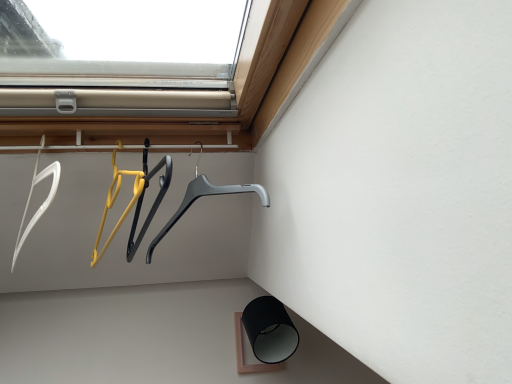
This screenshot has width=512, height=384. What do you see at coordinates (42, 203) in the screenshot?
I see `white plastic hanger at left, placed as the second hanger when sorted from right to left` at bounding box center [42, 203].

Locate an element on the screen. white plastic hanger at left, placed as the second hanger when sorted from right to left is located at coordinates (42, 203).

Measure the distance between white plastic hanger at left, placed as the second hanger when sorted from right to left, and camera.

A distance of 28.29 inches exists between white plastic hanger at left, placed as the second hanger when sorted from right to left, and camera.

The width and height of the screenshot is (512, 384). What do you see at coordinates (201, 196) in the screenshot?
I see `gray plastic hanger at center, arranged as the 2th hanger when viewed from the left` at bounding box center [201, 196].

You are a GUI agent. You are given a task and a screenshot of the screen. Output one action in this format:
    pyautogui.click(x=<x>, y=<y>)
    Task: Click on the gray plastic hanger at center, arranged as the 2th hanger when viewed from the left
    
    Given the screenshot: What is the action you would take?
    pyautogui.click(x=201, y=196)

At what (x,y) coordinates should I click in order to perform the action: click on white plastic hanger at left, the first hanger in the left-to-right sequence. Please return your answer as a coordinate pair (x, y). Looking at the image, I should click on (42, 203).

Considering the positions of objects gray plastic hanger at center, acting as the 1th hanger starting from the right, and white plastic hanger at left, placed as the second hanger when sorted from right to left, in the image provided, who is more to the left, gray plastic hanger at center, acting as the 1th hanger starting from the right, or white plastic hanger at left, placed as the second hanger when sorted from right to left,?

Positioned to the left is white plastic hanger at left, placed as the second hanger when sorted from right to left.

Is the position of gray plastic hanger at center, arranged as the 2th hanger when viewed from the left, more distant than that of white plastic hanger at left, the first hanger in the left-to-right sequence?

Yes, gray plastic hanger at center, arranged as the 2th hanger when viewed from the left, is further from the viewer.

Is point (213, 192) closer to camera compared to point (32, 218)?

No.

From the image's perspective, is gray plastic hanger at center, acting as the 1th hanger starting from the right, located above or below white plastic hanger at left, the first hanger in the left-to-right sequence?

gray plastic hanger at center, acting as the 1th hanger starting from the right, is below white plastic hanger at left, the first hanger in the left-to-right sequence.

From a real-world perspective, is gray plastic hanger at center, arranged as the 2th hanger when viewed from the left, physically located above or below white plastic hanger at left, placed as the second hanger when sorted from right to left?

gray plastic hanger at center, arranged as the 2th hanger when viewed from the left, is below white plastic hanger at left, placed as the second hanger when sorted from right to left.

Can you confirm if gray plastic hanger at center, acting as the 1th hanger starting from the right, is thinner than white plastic hanger at left, placed as the second hanger when sorted from right to left?

In fact, gray plastic hanger at center, acting as the 1th hanger starting from the right, might be wider than white plastic hanger at left, placed as the second hanger when sorted from right to left.

Which of these two, gray plastic hanger at center, arranged as the 2th hanger when viewed from the left, or white plastic hanger at left, placed as the second hanger when sorted from right to left, stands shorter?

With less height is gray plastic hanger at center, arranged as the 2th hanger when viewed from the left.

Does gray plastic hanger at center, acting as the 1th hanger starting from the right, have a smaller size compared to white plastic hanger at left, the first hanger in the left-to-right sequence?

Incorrect, gray plastic hanger at center, acting as the 1th hanger starting from the right, is not smaller in size than white plastic hanger at left, the first hanger in the left-to-right sequence.

Is gray plastic hanger at center, acting as the 1th hanger starting from the right, inside the boundaries of white plastic hanger at left, the first hanger in the left-to-right sequence, or outside?

gray plastic hanger at center, acting as the 1th hanger starting from the right, is outside white plastic hanger at left, the first hanger in the left-to-right sequence.

Is gray plastic hanger at center, arranged as the 2th hanger when viewed from the left, next to white plastic hanger at left, placed as the second hanger when sorted from right to left, and touching it?

No, gray plastic hanger at center, arranged as the 2th hanger when viewed from the left, is not beside white plastic hanger at left, placed as the second hanger when sorted from right to left.

Is gray plastic hanger at center, arranged as the 2th hanger when viewed from the left, turned away from white plastic hanger at left, the first hanger in the left-to-right sequence?

No.

Can you tell me how much gray plastic hanger at center, acting as the 1th hanger starting from the right, and white plastic hanger at left, the first hanger in the left-to-right sequence, differ in facing direction?

The angular difference between gray plastic hanger at center, acting as the 1th hanger starting from the right, and white plastic hanger at left, the first hanger in the left-to-right sequence, is 2.1 degrees.

The image size is (512, 384). Identify the location of hanger in front of the gray plastic hanger at center, arranged as the 2th hanger when viewed from the left. (42, 203).

Between white plastic hanger at left, the first hanger in the left-to-right sequence, and gray plastic hanger at center, acting as the 1th hanger starting from the right, which one appears on the right side from the viewer's perspective?

Positioned to the right is gray plastic hanger at center, acting as the 1th hanger starting from the right.

Between white plastic hanger at left, the first hanger in the left-to-right sequence, and gray plastic hanger at center, acting as the 1th hanger starting from the right, which one is positioned in front?

white plastic hanger at left, the first hanger in the left-to-right sequence, is more forward.

Considering the points (39, 179) and (180, 217), which point is behind, point (39, 179) or point (180, 217)?

The point (180, 217) is farther from the camera.

From the image's perspective, is white plastic hanger at left, placed as the second hanger when sorted from right to left, located beneath gray plastic hanger at center, arranged as the 2th hanger when viewed from the left?

No, from the image's perspective, white plastic hanger at left, placed as the second hanger when sorted from right to left, is not below gray plastic hanger at center, arranged as the 2th hanger when viewed from the left.

Based on the photo, from a real-world perspective, is white plastic hanger at left, placed as the second hanger when sorted from right to left, below gray plastic hanger at center, acting as the 1th hanger starting from the right?

No, from a real-world perspective, white plastic hanger at left, placed as the second hanger when sorted from right to left, is not beneath gray plastic hanger at center, acting as the 1th hanger starting from the right.

Which object is thinner, white plastic hanger at left, placed as the second hanger when sorted from right to left, or gray plastic hanger at center, acting as the 1th hanger starting from the right?

white plastic hanger at left, placed as the second hanger when sorted from right to left.

Between white plastic hanger at left, placed as the second hanger when sorted from right to left, and gray plastic hanger at center, acting as the 1th hanger starting from the right, which one has less height?

With less height is gray plastic hanger at center, acting as the 1th hanger starting from the right.

Is white plastic hanger at left, the first hanger in the left-to-right sequence, bigger than gray plastic hanger at center, arranged as the 2th hanger when viewed from the left?

Incorrect, white plastic hanger at left, the first hanger in the left-to-right sequence, is not larger than gray plastic hanger at center, arranged as the 2th hanger when viewed from the left.

Is white plastic hanger at left, placed as the second hanger when sorted from right to left, inside or outside of gray plastic hanger at center, acting as the 1th hanger starting from the right?

white plastic hanger at left, placed as the second hanger when sorted from right to left, is not enclosed by gray plastic hanger at center, acting as the 1th hanger starting from the right.

Would you consider white plastic hanger at left, placed as the second hanger when sorted from right to left, to be distant from gray plastic hanger at center, acting as the 1th hanger starting from the right?

white plastic hanger at left, placed as the second hanger when sorted from right to left, is near gray plastic hanger at center, acting as the 1th hanger starting from the right, not far away.

Is white plastic hanger at left, placed as the second hanger when sorted from right to left, facing towards gray plastic hanger at center, acting as the 1th hanger starting from the right?

No, white plastic hanger at left, placed as the second hanger when sorted from right to left, does not turn towards gray plastic hanger at center, acting as the 1th hanger starting from the right.

The width and height of the screenshot is (512, 384). Identify the location of hanger on the left side of gray plastic hanger at center, acting as the 1th hanger starting from the right. (42, 203).

You are a GUI agent. You are given a task and a screenshot of the screen. Output one action in this format:
    pyautogui.click(x=<x>, y=<y>)
    Task: Click on the hanger located below the white plastic hanger at left, the first hanger in the left-to-right sequence (from the image's perspective)
    
    Given the screenshot: What is the action you would take?
    pyautogui.click(x=201, y=196)

What are the coordinates of `hanger that appears above the gray plastic hanger at center, acting as the 1th hanger starting from the right (from the image's perspective)` in the screenshot? It's located at (42, 203).